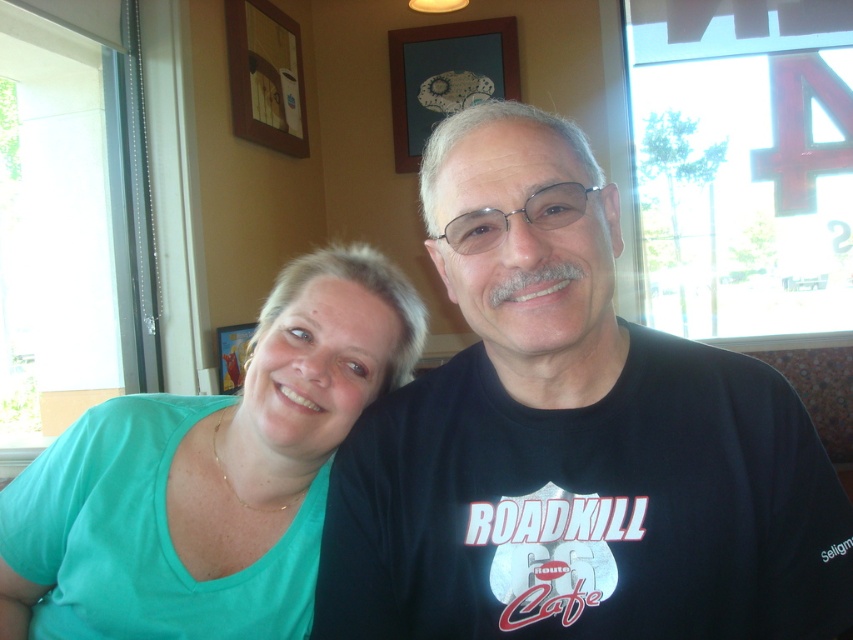
Question: Which object is farther from the camera taking this photo?

Choices:
 (A) black matte t-shirt at center
 (B) teal matte shirt at left

Answer: (B)

Question: Which of the following is the farthest from the observer?

Choices:
 (A) (376, 346)
 (B) (515, 541)

Answer: (A)

Question: Is the position of black matte t-shirt at center less distant than that of teal matte shirt at left?

Choices:
 (A) no
 (B) yes

Answer: (B)

Question: Can you confirm if black matte t-shirt at center is positioned above teal matte shirt at left?

Choices:
 (A) no
 (B) yes

Answer: (B)

Question: Does black matte t-shirt at center have a greater width compared to teal matte shirt at left?

Choices:
 (A) yes
 (B) no

Answer: (A)